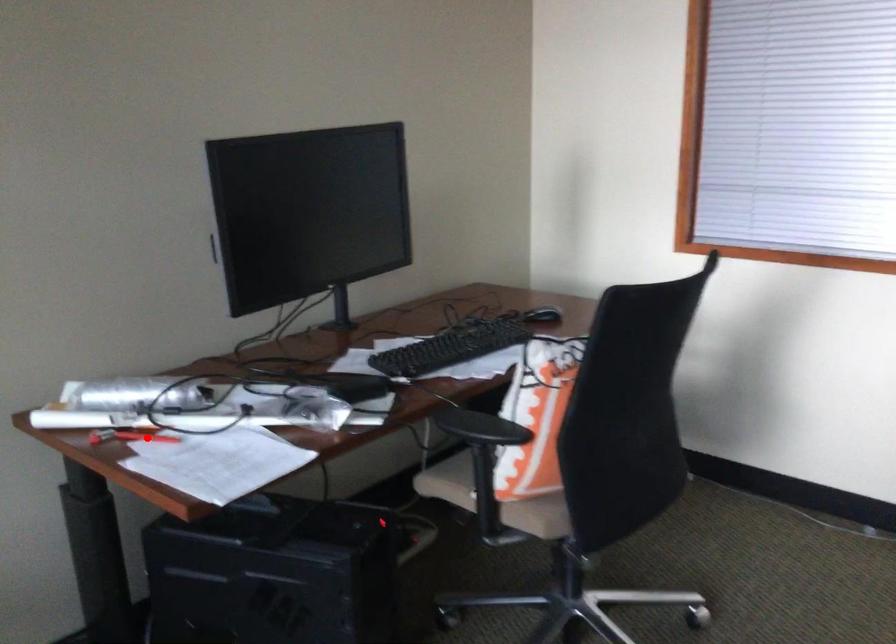
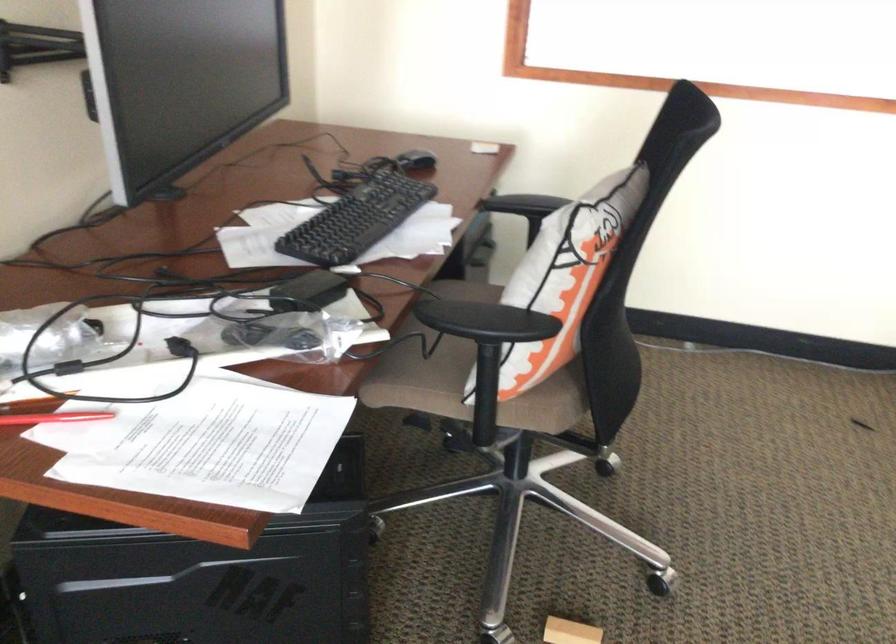
Question: I am providing you with two images of the same scene from different viewpoints. Given a red point in image1, look at the same physical point in image2. Is it:

Choices:
 (A) Closer to the viewpoint
 (B) Farther from the viewpoint

Answer: (A)